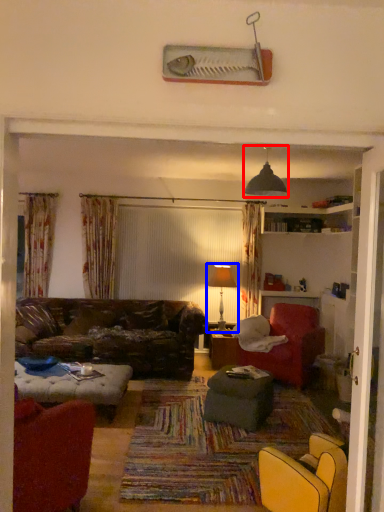
Question: Which object appears farthest to the camera in this image, light fixture (highlighted by a red box) or table lamp (highlighted by a blue box)?

Choices:
 (A) light fixture
 (B) table lamp

Answer: (B)